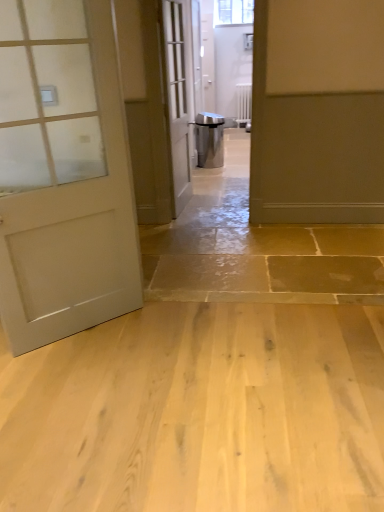
What are the coordinates of `vacant area situated below matte white door at left, which is the 1th door from left to right (from a real-world perspective)` in the screenshot? It's located at (92, 330).